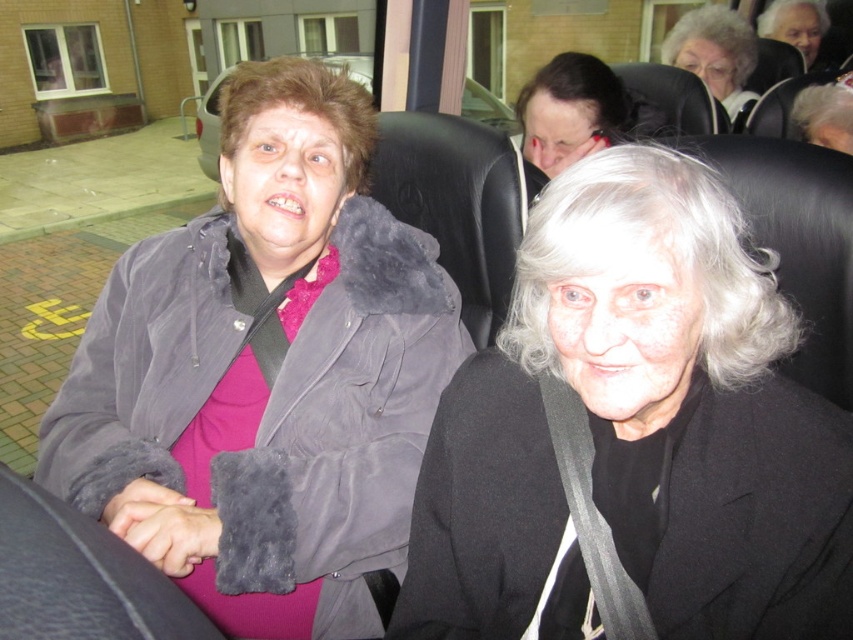
Question: Can you confirm if gray hair at upper right is positioned above gray fuzzy jacket at upper left?

Choices:
 (A) no
 (B) yes

Answer: (A)

Question: Is black woolen coat at center to the left of velvet-like gray coat at left from the viewer's perspective?

Choices:
 (A) no
 (B) yes

Answer: (A)

Question: Which point is closer to the camera?

Choices:
 (A) (717, 61)
 (B) (210, 99)
 (C) (756, 634)
 (D) (144, 339)

Answer: (C)

Question: Which of the following is the closest to the observer?

Choices:
 (A) (469, 88)
 (B) (733, 106)

Answer: (B)

Question: Which object appears farthest from the camera in this image?

Choices:
 (A) gray hair at upper right
 (B) gray fuzzy jacket at upper left
 (C) velvet-like gray coat at left
 (D) black woolen coat at center

Answer: (B)

Question: Is the position of velvet-like gray coat at left less distant than that of gray hair at upper right?

Choices:
 (A) yes
 (B) no

Answer: (A)